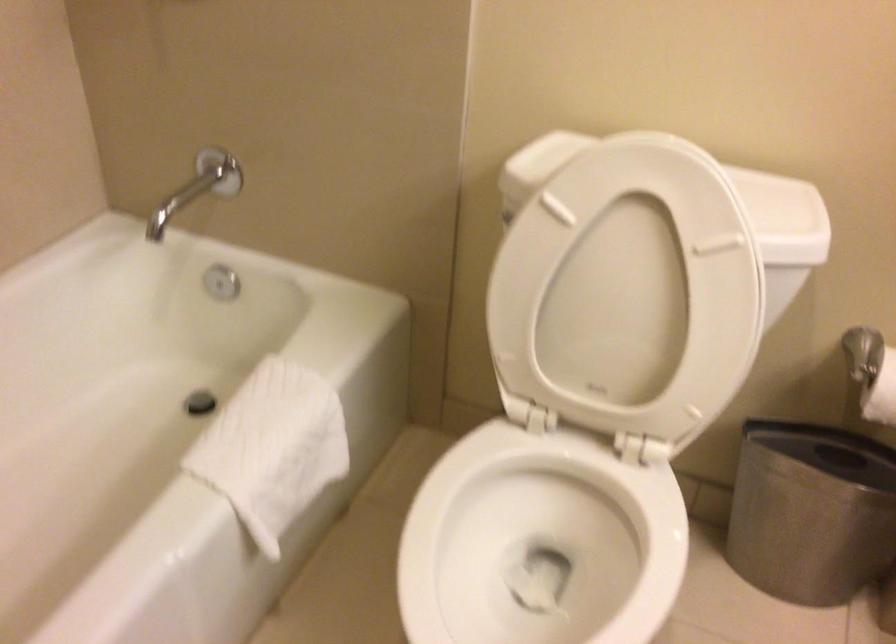
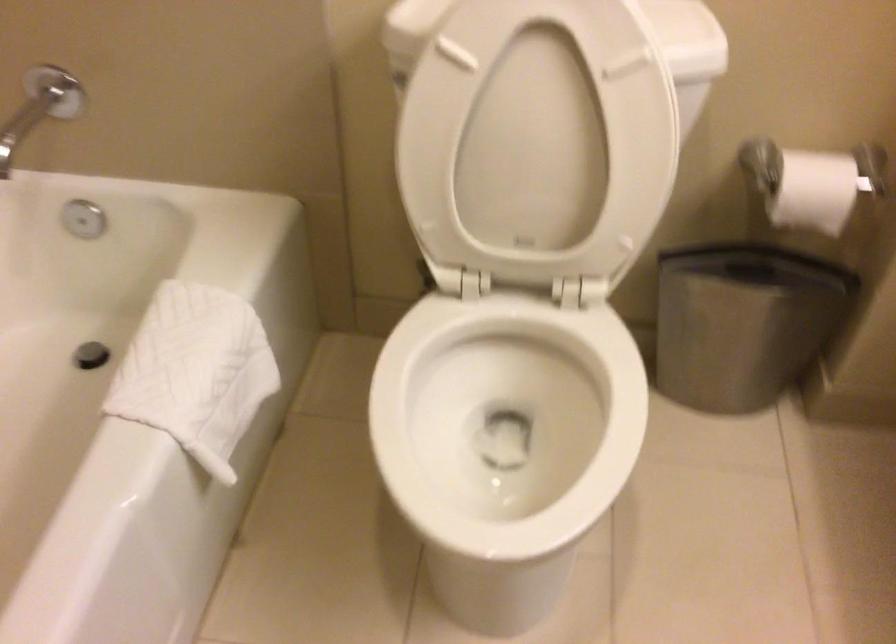
Where in the second image is the point corresponding to [623,301] from the first image?

(538, 140)